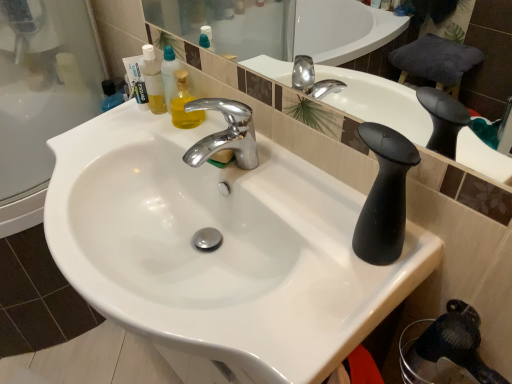
This screenshot has height=384, width=512. Identify the location of vacant space to the left of translucent plastic mouthwash at upper left. (108, 125).